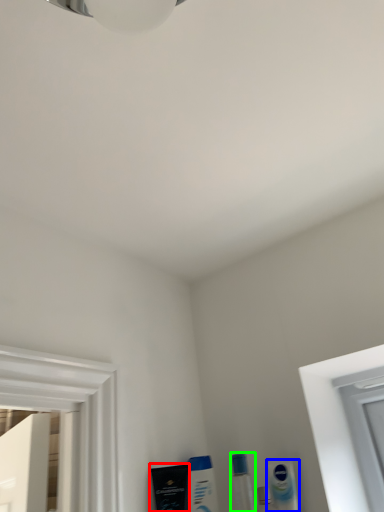
Question: Estimate the real-world distances between objects in this image. Which object is farther from mouthwash (highlighted by a red box), mouthwash (highlighted by a blue box) or toiletry (highlighted by a green box)?

Choices:
 (A) mouthwash
 (B) toiletry

Answer: (A)